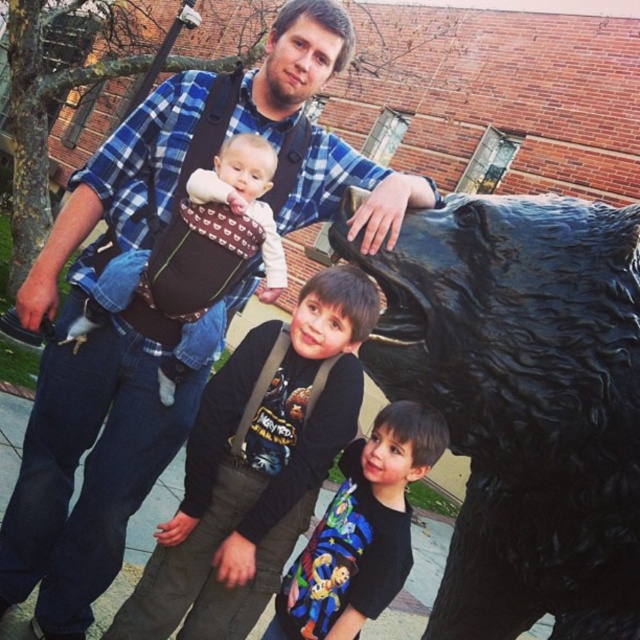
You are a photographer setting up for a family photo. You want to ensure there is enough space between the black glossy bear at right and the dark gray backpack at center so that the camera can capture both without any overlap. What is the minimum distance the camera needs to be from the subjects to avoid overlap?

The black glossy bear at right and dark gray backpack at center are 85.92 centimeters apart. To avoid overlap, the camera should be positioned at least 85.92 centimeters away from the closest subject.

In the scene shown: You are standing 3 meters away from the bear statue. Can you reach the point at coordinate point (484, 627) on the bear statue without moving closer?

The distance of point (484, 627) is 3.58 meters from the viewer, so you are currently 3 meters away and need to move 0.58 meters closer to reach it.